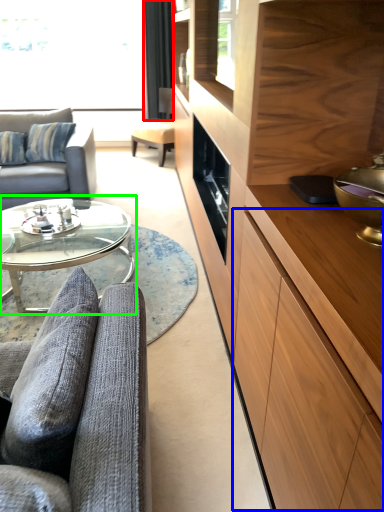
Question: Which object is the farthest from curtain (highlighted by a red box)? Choose among these: drawer (highlighted by a blue box) or coffee table (highlighted by a green box).

Choices:
 (A) drawer
 (B) coffee table

Answer: (A)